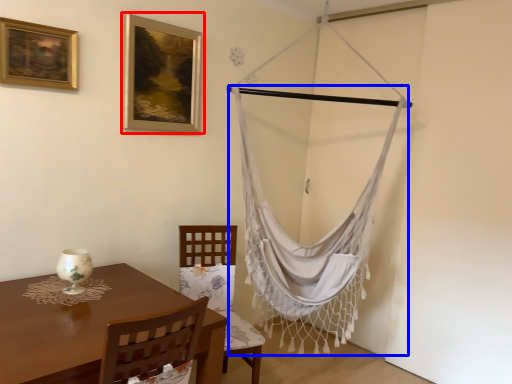
Question: Which of the following is the closest to the observer, picture frame (highlighted by a red box) or curtain (highlighted by a blue box)?

Choices:
 (A) picture frame
 (B) curtain

Answer: (A)